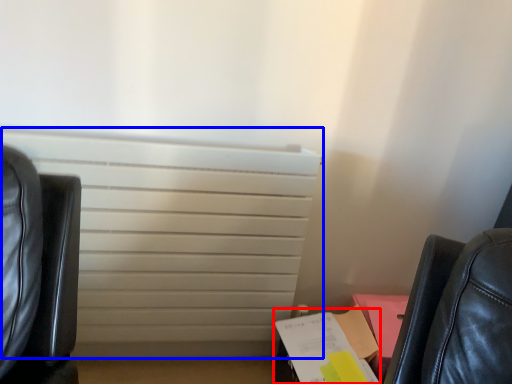
Question: Among these objects, which one is nearest to the camera, paperback book (highlighted by a red box) or radiator (highlighted by a blue box)?

Choices:
 (A) paperback book
 (B) radiator

Answer: (B)